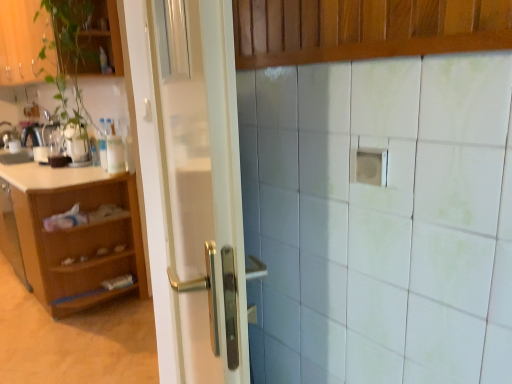
Question: From a real-world perspective, is white glossy sink at left beneath light brown wood cabinet at left, the first cabinetry positioned from the back?

Choices:
 (A) no
 (B) yes

Answer: (A)

Question: Is white glossy sink at left looking in the opposite direction of light brown wood cabinet at left, the first cabinetry positioned from the back?

Choices:
 (A) no
 (B) yes

Answer: (A)

Question: Is there a large distance between white glossy sink at left and light brown wood cabinet at left, the first cabinetry when ordered from bottom to top?

Choices:
 (A) yes
 (B) no

Answer: (B)

Question: Is white glossy sink at left in front of light brown wood cabinet at left, the 3th cabinetry in the front-to-back sequence?

Choices:
 (A) yes
 (B) no

Answer: (B)

Question: Does white glossy sink at left have a lesser width compared to light brown wood cabinet at left, the 3th cabinetry in the top-to-bottom sequence?

Choices:
 (A) yes
 (B) no

Answer: (A)

Question: From a real-world perspective, is green glossy plant at upper left above or below green matte plant at upper left, acting as the 1th cabinetry starting from the top?

Choices:
 (A) above
 (B) below

Answer: (B)

Question: Do you think green glossy plant at upper left is within green matte plant at upper left, which is counted as the second cabinetry, starting from the front, or outside of it?

Choices:
 (A) outside
 (B) inside

Answer: (B)

Question: Is point (50, 18) positioned closer to the camera than point (52, 36)?

Choices:
 (A) closer
 (B) farther

Answer: (A)

Question: From the image's perspective, is green glossy plant at upper left above or below green matte plant at upper left, acting as the 1th cabinetry starting from the top?

Choices:
 (A) above
 (B) below

Answer: (B)

Question: Relative to white glossy door at center, is wooden paneling at upper center, placed as the 2th cabinetry when sorted from bottom to top, in front or behind?

Choices:
 (A) behind
 (B) front

Answer: (A)

Question: Visually, is wooden paneling at upper center, placed as the 2th cabinetry when sorted from bottom to top, positioned to the left or to the right of white glossy door at center?

Choices:
 (A) left
 (B) right

Answer: (B)

Question: From a real-world perspective, is wooden paneling at upper center, which is counted as the 2th cabinetry, starting from the top, physically located above or below white glossy door at center?

Choices:
 (A) below
 (B) above

Answer: (B)

Question: In terms of width, does wooden paneling at upper center, placed as the 2th cabinetry when sorted from bottom to top, look wider or thinner when compared to white glossy door at center?

Choices:
 (A) wide
 (B) thin

Answer: (B)

Question: Is light brown wood cabinet at left, the 3th cabinetry in the front-to-back sequence, taller or shorter than green matte plant at upper left, the second cabinetry in the back-to-front sequence?

Choices:
 (A) short
 (B) tall

Answer: (B)

Question: In the image, is light brown wood cabinet at left, the 3th cabinetry in the top-to-bottom sequence, positioned in front of or behind green matte plant at upper left, which is the third cabinetry in bottom-to-top order?

Choices:
 (A) front
 (B) behind

Answer: (B)